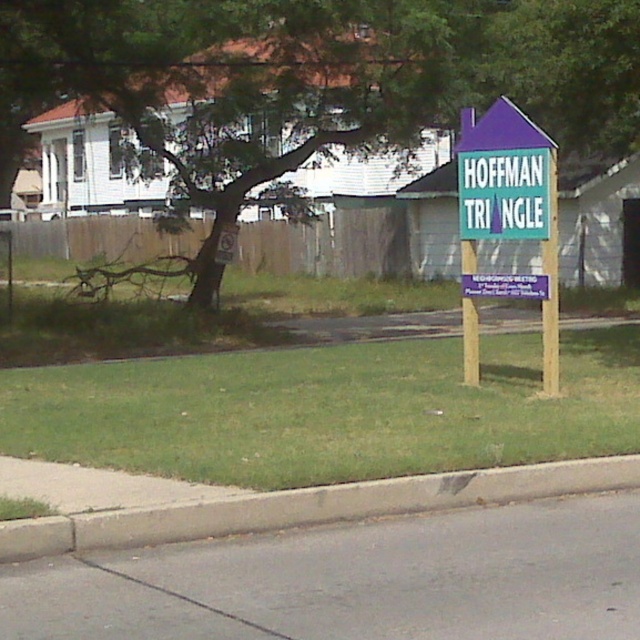
Question: Is purple wood sign at right to the right of purple wood signpost at center from the viewer's perspective?

Choices:
 (A) yes
 (B) no

Answer: (A)

Question: Is green grass at center positioned before green plastic signpost at center-right?

Choices:
 (A) no
 (B) yes

Answer: (B)

Question: From the image, what is the correct spatial relationship of green leafy tree at center in relation to purple wood sign at right?

Choices:
 (A) below
 (B) above

Answer: (B)

Question: Which object appears farthest from the camera in this image?

Choices:
 (A) green grass at center
 (B) green leafy tree at center
 (C) green plastic signpost at center-right
 (D) purple wood sign at right

Answer: (B)

Question: Which of these objects is positioned closest to the green grass at center?

Choices:
 (A) green plastic signpost at center-right
 (B) concrete at lower left

Answer: (A)

Question: Which of the following is the closest to the observer?

Choices:
 (A) (54, 444)
 (B) (547, 42)

Answer: (A)